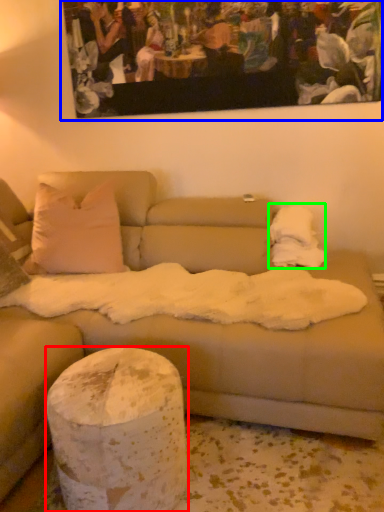
Question: Estimate the real-world distances between objects in this image. Which object is closer to pillar (highlighted by a red box), picture frame (highlighted by a blue box) or blanket (highlighted by a green box)?

Choices:
 (A) picture frame
 (B) blanket

Answer: (B)